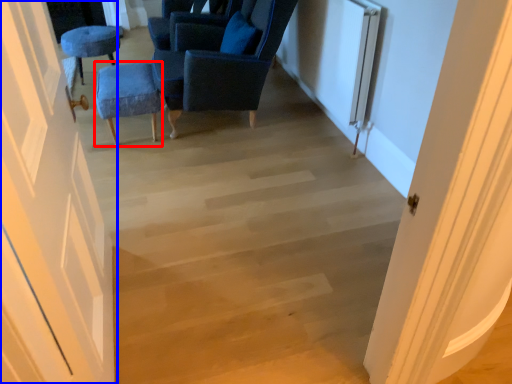
Question: Which point is further to the camera, furniture (highlighted by a red box) or door (highlighted by a blue box)?

Choices:
 (A) furniture
 (B) door

Answer: (A)